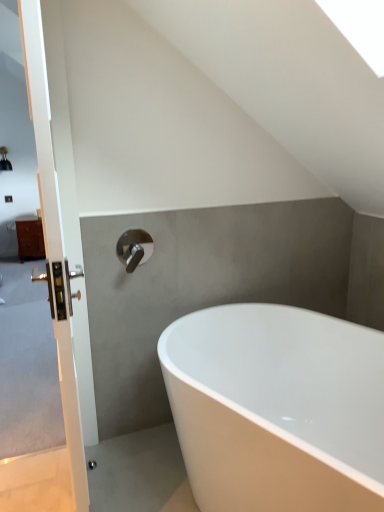
Question: Is white glossy bathtub at center inside white glossy door handle at left?

Choices:
 (A) yes
 (B) no

Answer: (B)

Question: From a real-world perspective, is white glossy door handle at left on top of white glossy bathtub at center?

Choices:
 (A) no
 (B) yes

Answer: (B)

Question: Considering the relative sizes of white glossy door handle at left and white glossy bathtub at center in the image provided, is white glossy door handle at left thinner than white glossy bathtub at center?

Choices:
 (A) yes
 (B) no

Answer: (A)

Question: Is the depth of white glossy door handle at left greater than that of white glossy bathtub at center?

Choices:
 (A) no
 (B) yes

Answer: (A)

Question: Could you tell me if white glossy door handle at left is turned towards white glossy bathtub at center?

Choices:
 (A) no
 (B) yes

Answer: (A)

Question: Can we say white glossy door handle at left lies outside white glossy bathtub at center?

Choices:
 (A) yes
 (B) no

Answer: (A)

Question: Can you confirm if satin nickel faucet at upper center is positioned to the right of white glossy door handle at left?

Choices:
 (A) no
 (B) yes

Answer: (B)

Question: Is satin nickel faucet at upper center directly adjacent to white glossy door handle at left?

Choices:
 (A) yes
 (B) no

Answer: (B)

Question: Is satin nickel faucet at upper center smaller than white glossy door handle at left?

Choices:
 (A) no
 (B) yes

Answer: (B)

Question: Is satin nickel faucet at upper center wider than white glossy door handle at left?

Choices:
 (A) yes
 (B) no

Answer: (A)

Question: Considering the relative positions of satin nickel faucet at upper center and white glossy door handle at left in the image provided, is satin nickel faucet at upper center to the left of white glossy door handle at left from the viewer's perspective?

Choices:
 (A) no
 (B) yes

Answer: (A)

Question: Does satin nickel faucet at upper center have a lesser height compared to white glossy door handle at left?

Choices:
 (A) yes
 (B) no

Answer: (A)

Question: Are white glossy bathtub at center and satin nickel faucet at upper center making contact?

Choices:
 (A) yes
 (B) no

Answer: (B)